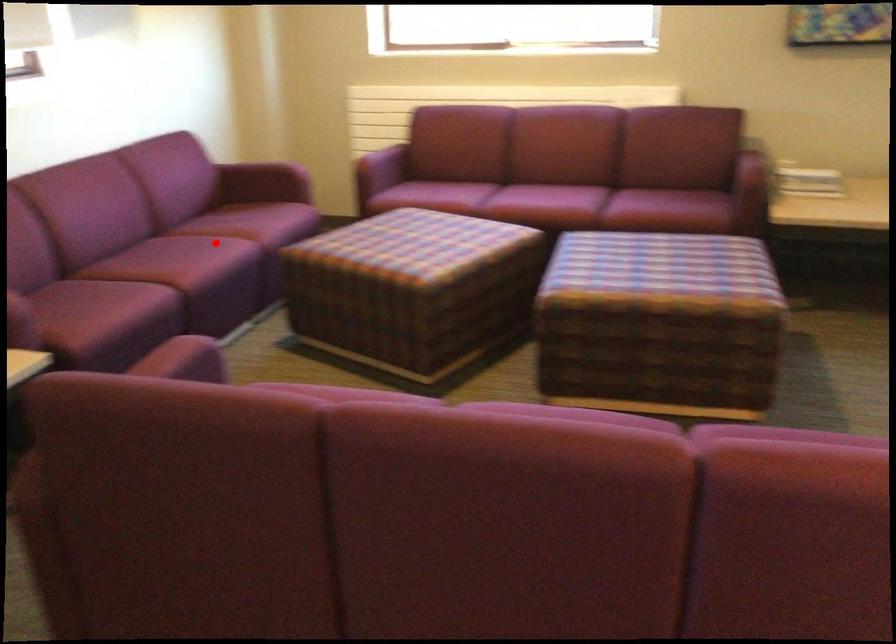
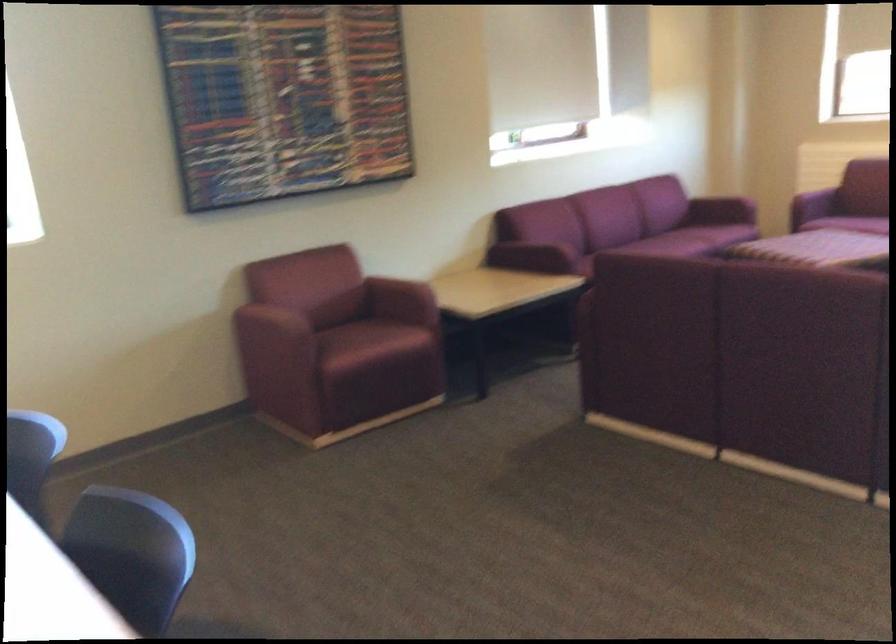
Find the pixel in the second image that matches the highlighted location in the first image.

(683, 242)